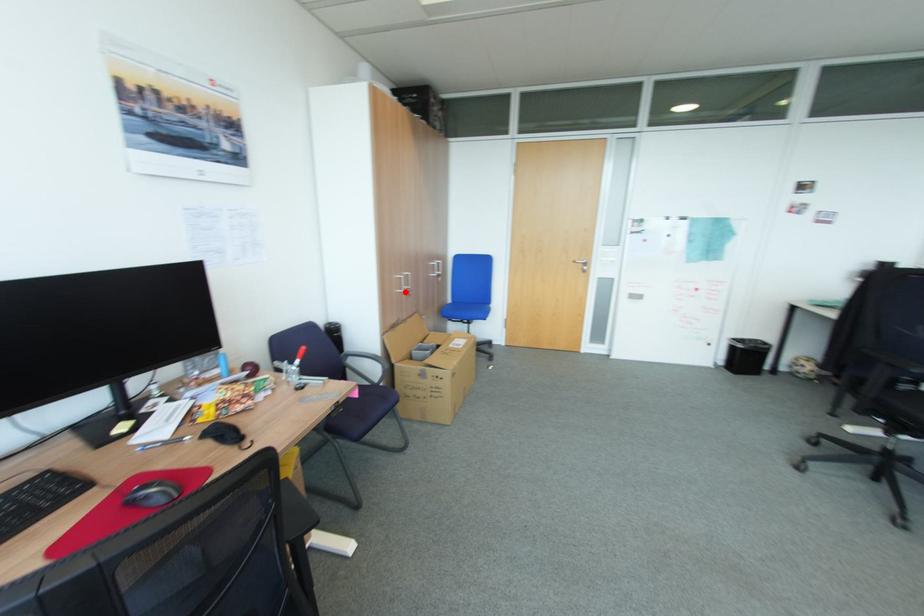
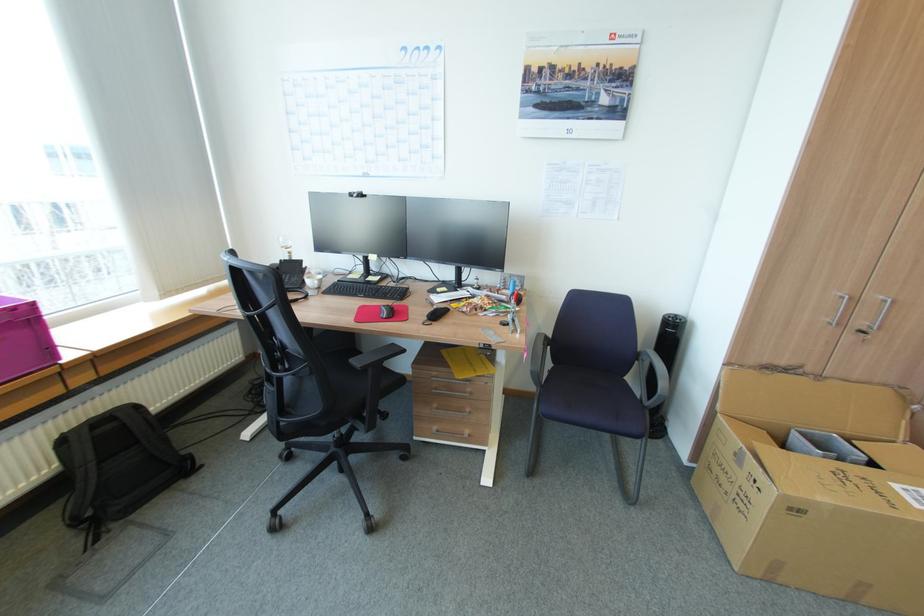
In the second image, find the point that corresponds to the highlighted location in the first image.

(833, 323)